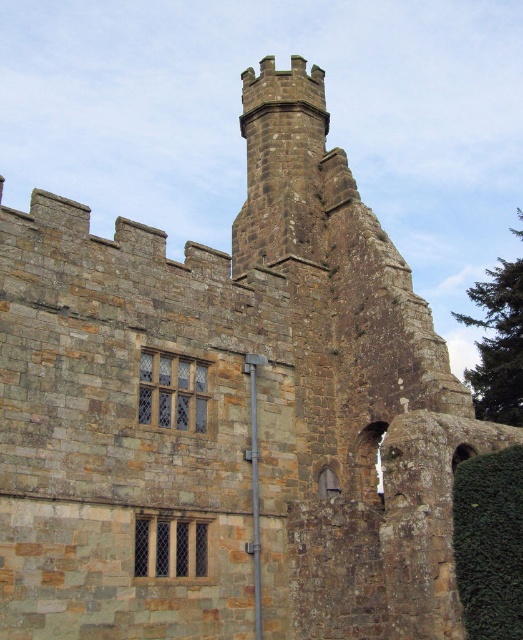
Can you confirm if green leafy ivy at lower right is wider than green leafy ivy at right?

No.

What are the coordinates of `green leafy ivy at lower right` in the screenshot? It's located at (490, 541).